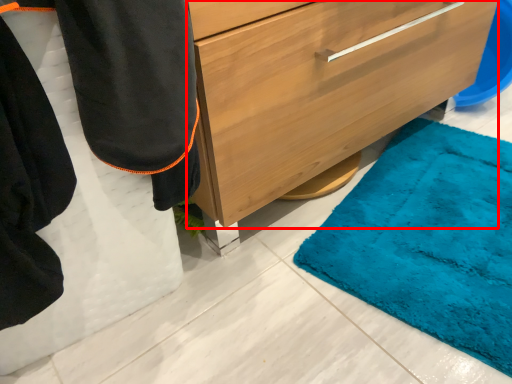
Question: In this image, where is chest of drawers (annotated by the red box) located relative to robe?

Choices:
 (A) right
 (B) left

Answer: (A)